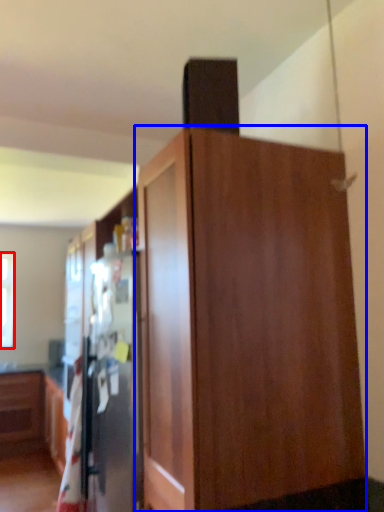
Question: Which object is closer to the camera taking this photo, window (highlighted by a red box) or cupboard (highlighted by a blue box)?

Choices:
 (A) window
 (B) cupboard

Answer: (B)